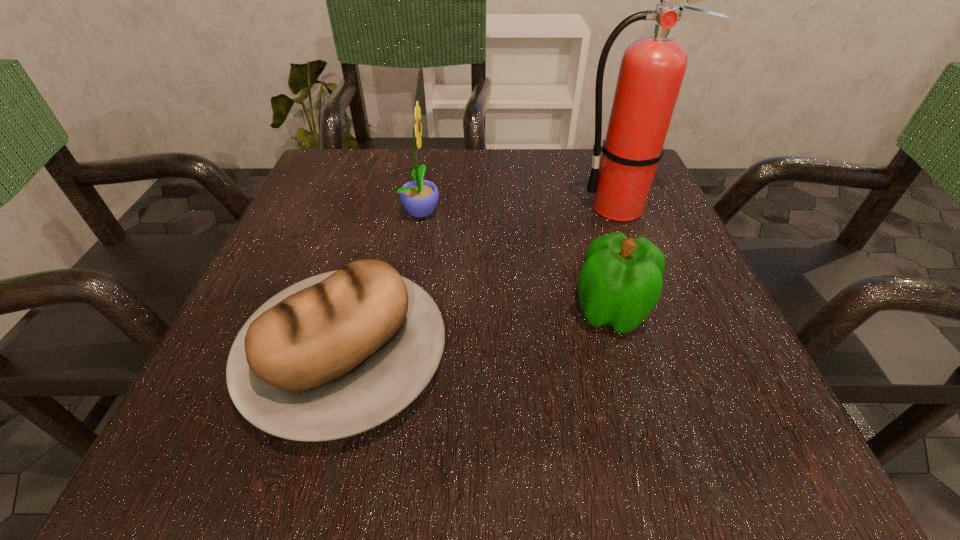
Where is `the tallest object`? the tallest object is located at coordinates (652, 69).

At what (x,y) coordinates should I click in order to perform the action: click on sunflower. Please return your answer as a coordinate pair (x, y). This screenshot has height=540, width=960. Looking at the image, I should click on (419, 197).

Where is `bell pepper`? bell pepper is located at coordinates (620, 282).

Identify the location of bread. Image resolution: width=960 pixels, height=540 pixels. (339, 353).

At what (x,y) coordinates should I click in order to perform the action: click on vacant space situated 0.140m on the hose direction of the fire extinguisher. Please return your answer as a coordinate pair (x, y). The image size is (960, 540). Looking at the image, I should click on (504, 207).

This screenshot has height=540, width=960. What are the coordinates of `free region located on the hose direction of the fire extinguisher` in the screenshot? It's located at (499, 207).

Identify the location of free space located on the hose direction of the fire extinguisher. The height and width of the screenshot is (540, 960). pyautogui.click(x=386, y=207).

Image resolution: width=960 pixels, height=540 pixels. I want to click on vacant space located 0.290m on the front-facing side of the sunflower, so click(x=585, y=211).

This screenshot has height=540, width=960. I want to click on free space located on the left of the bell pepper, so click(481, 311).

Image resolution: width=960 pixels, height=540 pixels. Find the location of `free space located on the right of the bread`. free space located on the right of the bread is located at coordinates (538, 356).